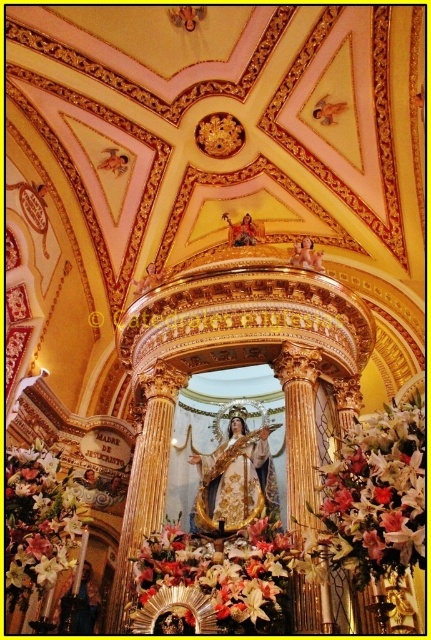
You are standing in the church and want to place a small candle on the altar. The floral bouquet at center and the white silk flower at lower left are already present. Which object is closer to you so that you can place the candle next to it?

The floral bouquet at center is closer to the viewer than the white silk flower at lower left, so you can place the candle next to the floral bouquet at center.

You are an interior designer planning to add a new decorative element to the church scene. You have a golden statue that needs to be placed between the floral bouquet at center and the white silk flower at lower left. Based on their current positions, where should you position the statue to ensure it is centered between them?

The floral bouquet at center is to the right of the white silk flower at lower left, so to center the golden statue between them, place it halfway between the two objects along the horizontal axis, ensuring it aligns centrally between their left and right positions.

You are an interior designer assessing the church layout. You need to determine the spatial relationship between the white silk flowers at right and the floral bouquet at center. Which object is located above the other?

The white silk flowers at right is positioned over floral bouquet at center, meaning it is above the floral bouquet at center.